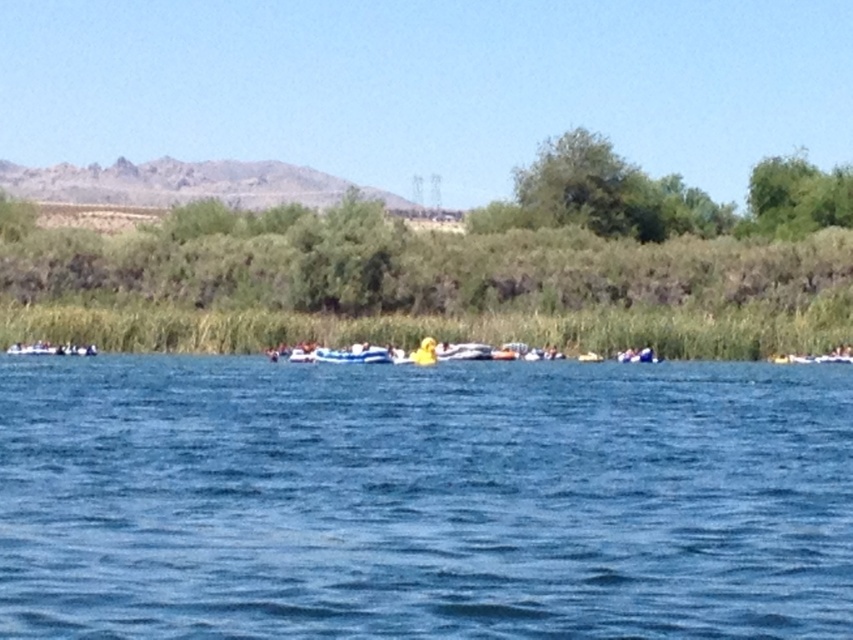
Question: Is blue water at center positioned in front of yellow rubber boat at center?

Choices:
 (A) yes
 (B) no

Answer: (A)

Question: Is blue water at center to the right of yellow rubber boat at center from the viewer's perspective?

Choices:
 (A) no
 (B) yes

Answer: (B)

Question: Which object is farther from the camera taking this photo?

Choices:
 (A) yellow rubber boat at center
 (B) blue water at center

Answer: (A)

Question: Which point is farther to the camera?

Choices:
 (A) (399, 428)
 (B) (68, 346)

Answer: (B)

Question: Is blue water at center wider than yellow rubber boat at center?

Choices:
 (A) no
 (B) yes

Answer: (B)

Question: Which point appears closest to the camera in this image?

Choices:
 (A) (271, 472)
 (B) (42, 342)

Answer: (A)